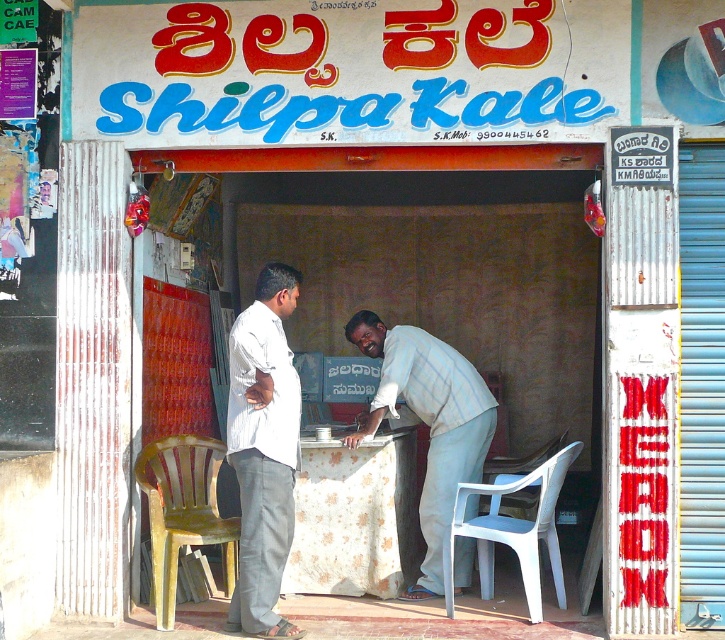
Does white cotton shirt at center have a lesser height compared to light blue fabric shirt at center?

No, white cotton shirt at center is not shorter than light blue fabric shirt at center.

Between white cotton shirt at center and light blue fabric shirt at center, which one has less height?

Standing shorter between the two is light blue fabric shirt at center.

Does point (228, 342) come closer to viewer compared to point (431, 378)?

That is False.

Identify the location of white cotton shirt at center. The width and height of the screenshot is (725, 640). (262, 449).

Does white cotton shirt at center come behind yellow plastic chair at lower left?

No, it is not.

This screenshot has height=640, width=725. Describe the element at coordinates (262, 449) in the screenshot. I see `white cotton shirt at center` at that location.

I want to click on white cotton shirt at center, so click(262, 449).

Looking at this image, is white cotton shirt at center smaller than floral fabric tablecloth at center?

Correct, white cotton shirt at center occupies less space than floral fabric tablecloth at center.

Does white cotton shirt at center have a greater width compared to floral fabric tablecloth at center?

In fact, white cotton shirt at center might be narrower than floral fabric tablecloth at center.

The image size is (725, 640). What do you see at coordinates (262, 449) in the screenshot?
I see `white cotton shirt at center` at bounding box center [262, 449].

At what (x,y) coordinates should I click in order to perform the action: click on white cotton shirt at center. Please return your answer as a coordinate pair (x, y). The image size is (725, 640). Looking at the image, I should click on (262, 449).